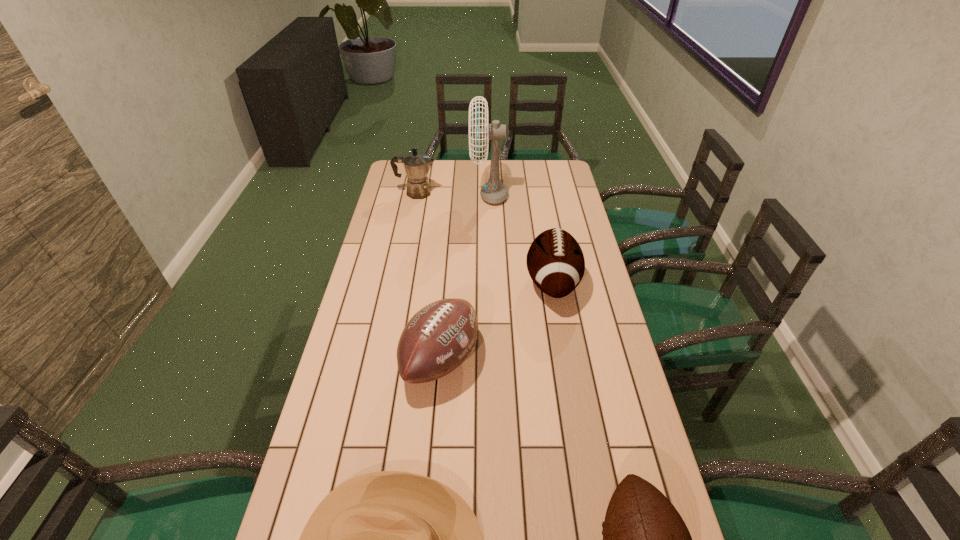
Locate an element on the screen. The width and height of the screenshot is (960, 540). blank space located 0.180m on the front of the third farthest object is located at coordinates click(565, 362).

You are a GUI agent. You are given a task and a screenshot of the screen. Output one action in this format:
    pyautogui.click(x=<x>, y=<y>)
    Task: Click on the fan situated at the far edge
    The width and height of the screenshot is (960, 540).
    Given the screenshot: What is the action you would take?
    pyautogui.click(x=494, y=192)

Find the location of a particular element. The height and width of the screenshot is (540, 960). coffeepot located at the far edge is located at coordinates (416, 165).

In order to click on object at the left edge in this screenshot , I will do `click(416, 165)`.

At what (x,y) coordinates should I click in order to perform the action: click on object located at the right edge. Please return your answer as a coordinate pair (x, y). Looking at the image, I should click on (555, 261).

This screenshot has width=960, height=540. I want to click on object located at the far left corner, so click(416, 165).

Locate an element on the screen. The width and height of the screenshot is (960, 540). blank space at the far edge is located at coordinates (512, 169).

Where is `free space at the left edge of the desktop`? The image size is (960, 540). free space at the left edge of the desktop is located at coordinates (383, 366).

Identify the location of free space at the right edge. (620, 383).

At what (x,y) coordinates should I click in order to perform the action: click on blank space at the far right corner. Please return your answer as a coordinate pair (x, y). Looking at the image, I should click on (546, 163).